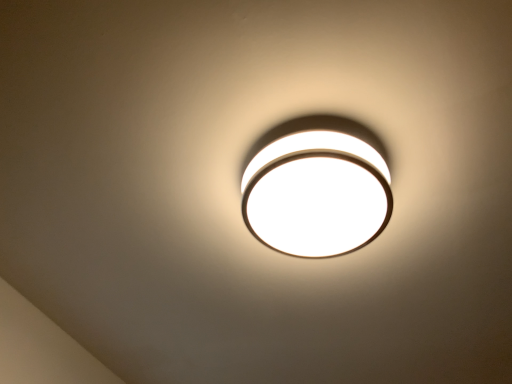
Find the location of a particular element. Image resolution: width=512 pixels, height=384 pixels. white glossy lamp at center is located at coordinates (317, 188).

Measure the distance between point (327, 192) and camera.

They are 76.90 centimeters apart.

The height and width of the screenshot is (384, 512). What do you see at coordinates (317, 188) in the screenshot?
I see `white glossy lamp at center` at bounding box center [317, 188].

Where is `white glossy lamp at center`? Image resolution: width=512 pixels, height=384 pixels. white glossy lamp at center is located at coordinates (317, 188).